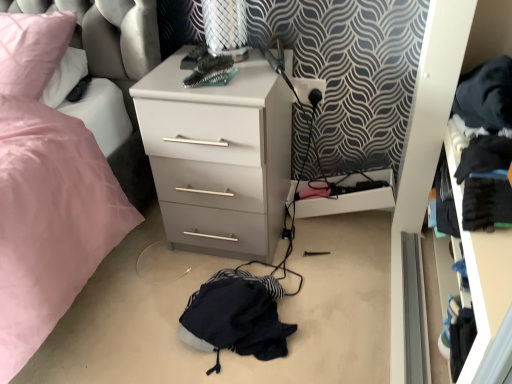
Identify the location of free space that is in between black fabric drawer at right and white plastic drawer at lower center. (356, 279).